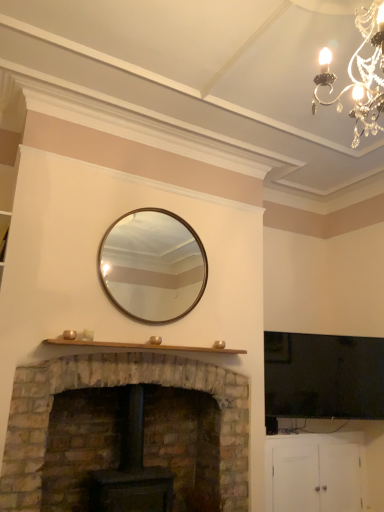
Identify the location of free space above silver metallic mirror at center (from a real-world perspective). (159, 208).